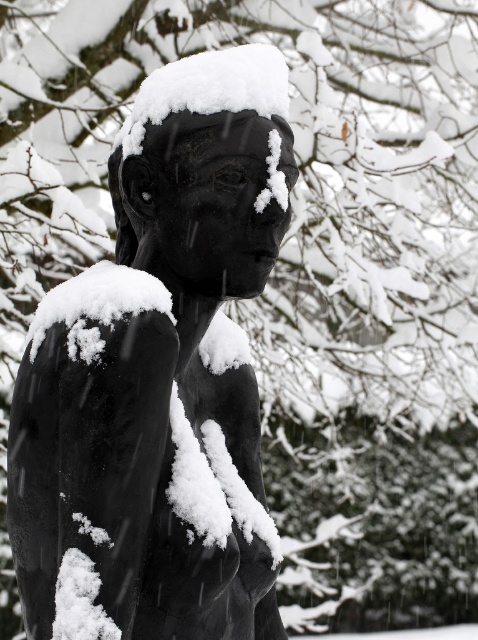
You are a photographer trying to capture the contrast between the matte black statue at center and the white fluffy snow at center. Based on their positions, which one is lower in the image?

The matte black statue at center is located below white fluffy snow at center, so the statue is lower in the image.

You are an artist planning to photograph the matte black statue at center and the white fluffy snow at center. Which object should you focus on to ensure the larger subject is in sharp detail?

The matte black statue at center has a larger size compared to the white fluffy snow at center, so you should focus on the matte black statue at center to ensure the larger subject is in sharp detail.